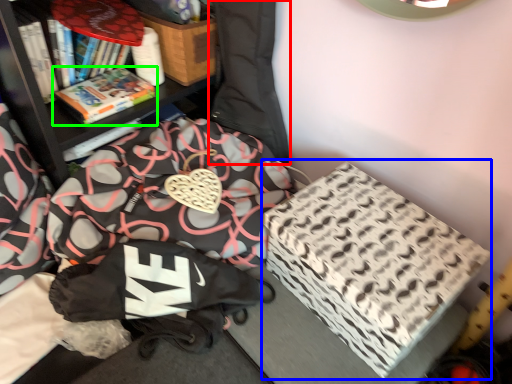
Question: Estimate the real-world distances between objects in this image. Which object is closer to bean bag chair (highlighted by a red box), cardboard box (highlighted by a blue box) or book (highlighted by a green box)?

Choices:
 (A) cardboard box
 (B) book

Answer: (B)